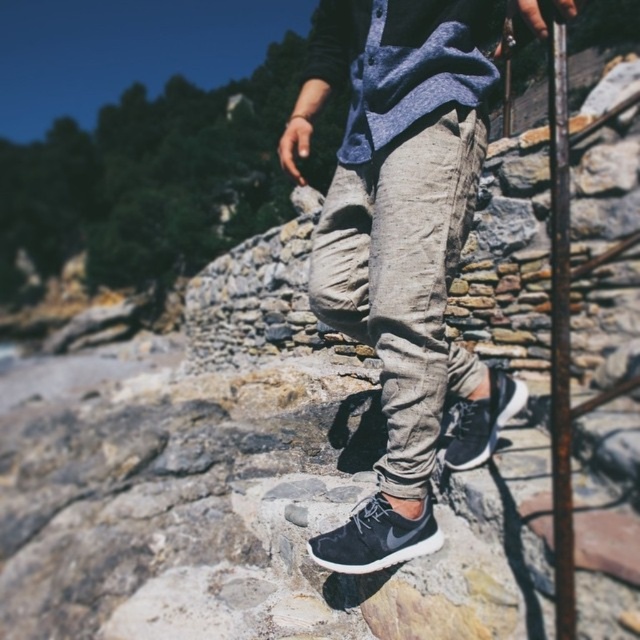
You are a photographer trying to capture the matte black sneaker at lower center in focus while the gray cotton pants at center is blurred in the background. Is this possible given their positions?

The gray cotton pants at center is in front of the matte black sneaker at lower center, so focusing on the sneaker would require the pants to be out of focus. This is achievable by adjusting the camera aperture for a shallow depth of field, making the sneaker sharp while the pants blur.

You are a photographer trying to capture the gray cotton pants at center and the matte black sneaker at lower center in a single frame. Based on their positions, which object should you focus on first to ensure both are in the shot?

Since the gray cotton pants at center are to the left of the matte black sneaker at lower center, you should focus on the gray cotton pants at center first to ensure both are in the frame.

You are a shoemaker trying to fit a customer with a narrow foot. The customer has brought two shoes to choose from. Based on the image, which sneaker between the dark gray suede sneaker at lower center and the matte black sneaker at lower center would be more suitable for their foot width?

The matte black sneaker at lower center would be more suitable for the customer with a narrow foot since its width is smaller than the dark gray suede sneaker at lower center.